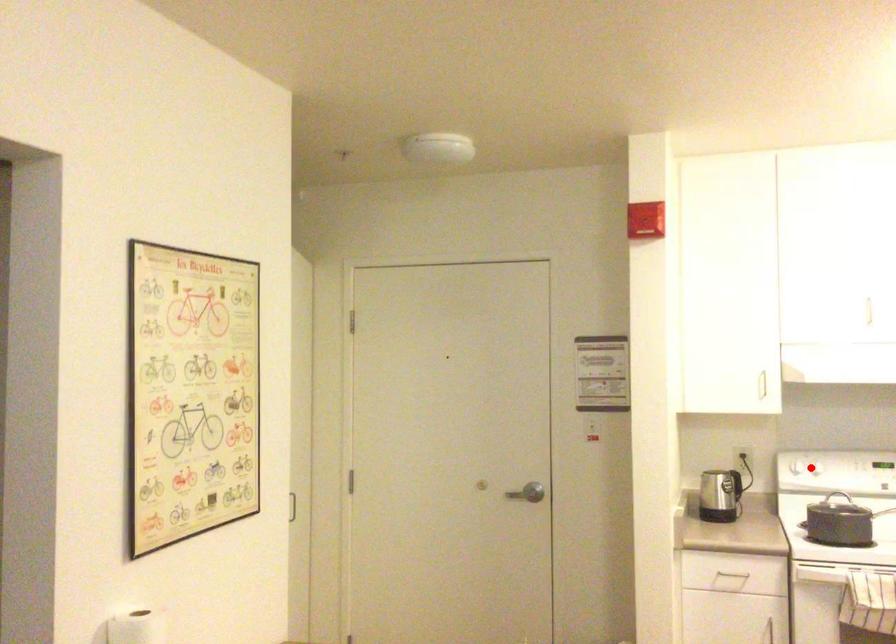
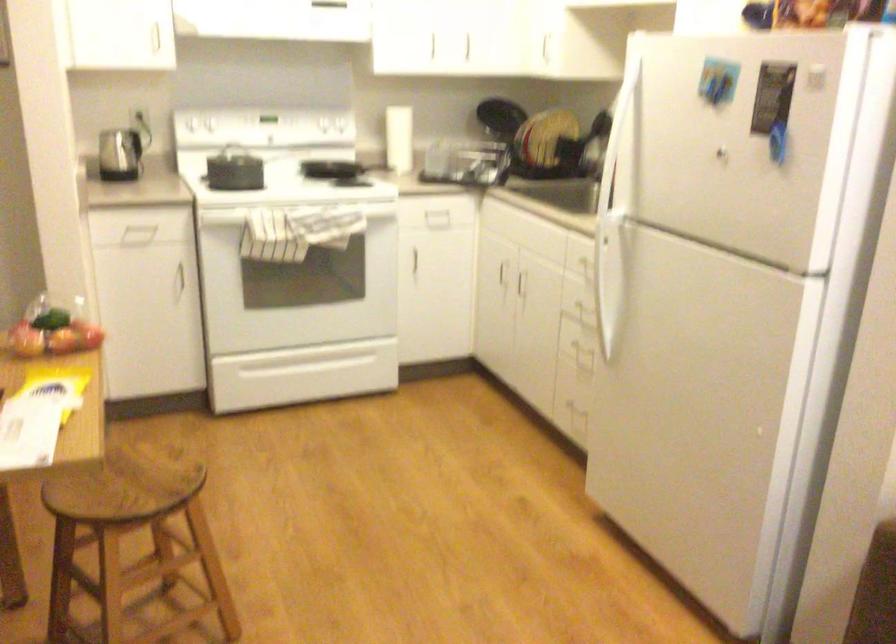
In the second image, find the point that corresponds to the highlighted location in the first image.

(200, 122)